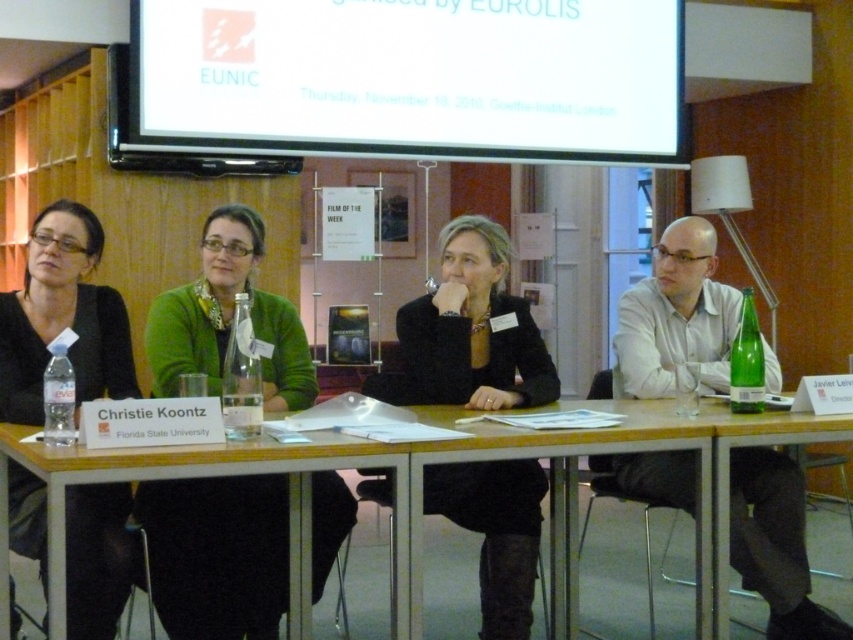
Is black matte jacket at center shorter than clear plastic bottle at left?

No.

Who is more forward, (514, 557) or (55, 346)?

Positioned in front is point (55, 346).

The height and width of the screenshot is (640, 853). What are the coordinates of `black matte jacket at center` in the screenshot? It's located at (468, 332).

Between black matte jacket at center and matte black jacket at left, which one is positioned higher?

matte black jacket at left

In the scene shown: Can you confirm if black matte jacket at center is thinner than matte black jacket at left?

No, black matte jacket at center is not thinner than matte black jacket at left.

Does point (450, 401) lie in front of point (80, 392)?

That is False.

I want to click on black matte jacket at center, so click(x=468, y=332).

Is matte white shirt at right wider than matte black jacket at left?

Yes.

Is matte white shirt at right smaller than matte black jacket at left?

Correct, matte white shirt at right occupies less space than matte black jacket at left.

Between point (744, 520) and point (137, 394), which one is positioned behind?

The point (744, 520) is behind.

The width and height of the screenshot is (853, 640). I want to click on matte white shirt at right, so click(x=676, y=317).